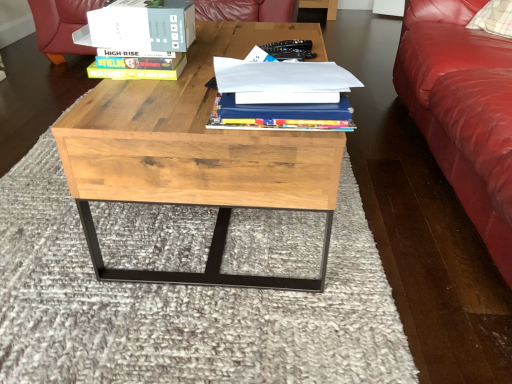
At what (x,y) coordinates should I click in order to perform the action: click on vacant position to the left of blue hardcover book at center. Please return your answer as a coordinate pair (x, y). Image resolution: width=512 pixels, height=384 pixels. Looking at the image, I should click on (147, 110).